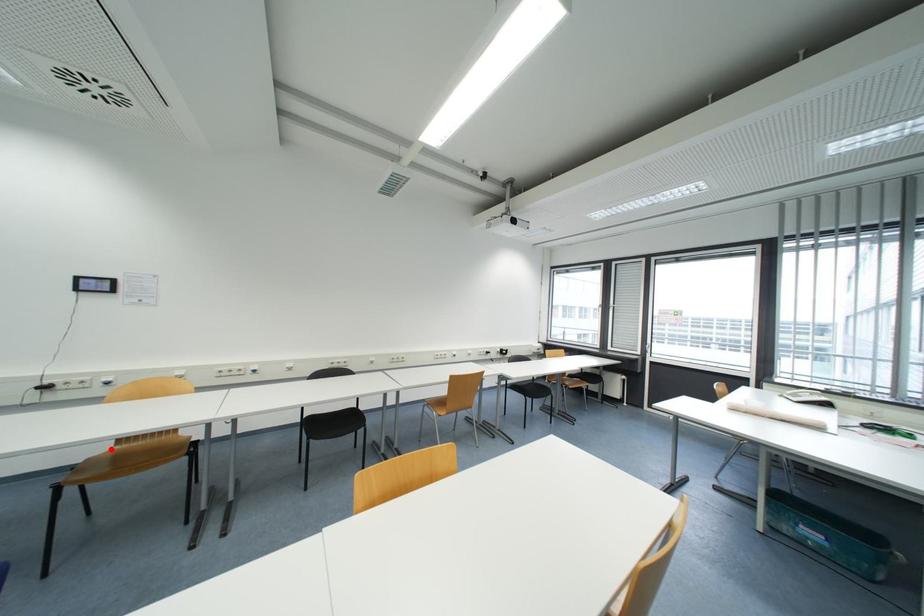
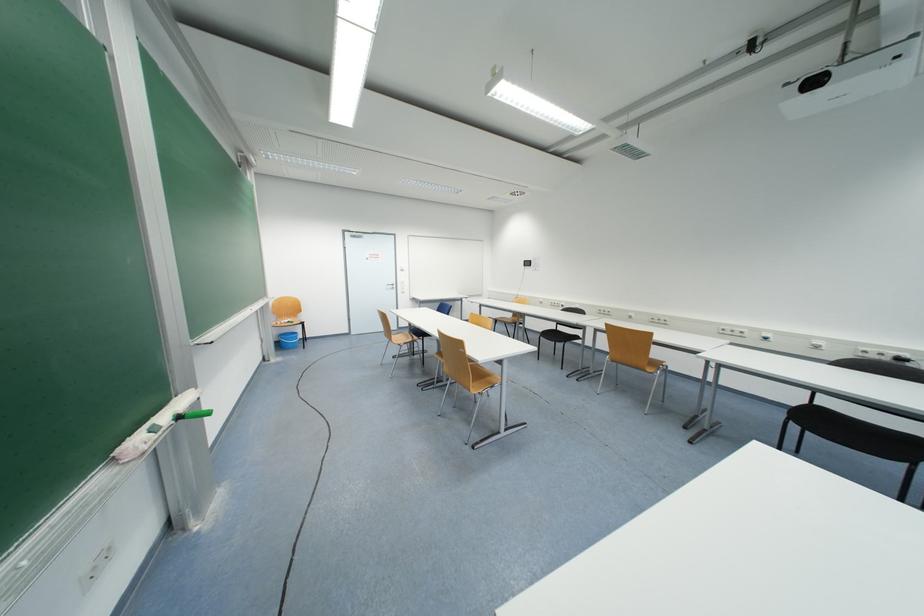
Find the pixel in the second image that matches the highlighted location in the first image.

(515, 318)